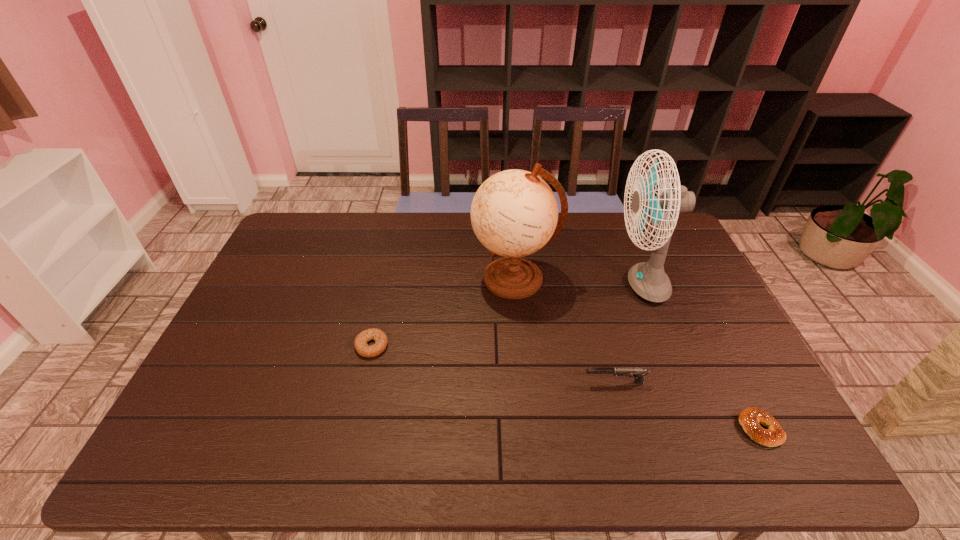
Find the location of a particular element. This screenshot has width=960, height=540. vacant space situated on the front-facing side of the fan is located at coordinates (489, 285).

Locate an element on the screen. The image size is (960, 540). vacant area located on the surface of the globe is located at coordinates (407, 279).

Find the location of a particular element. free space located on the surface of the globe is located at coordinates (456, 279).

This screenshot has height=540, width=960. I want to click on free space located on the surface of the globe, so click(417, 279).

At what (x,y) coordinates should I click in order to perform the action: click on vacant space located at the muzzle end of the gun. Please return your answer as a coordinate pair (x, y). The image size is (960, 540). Looking at the image, I should click on (476, 383).

Find the location of a particular element. This screenshot has height=540, width=960. free space located at the muzzle end of the gun is located at coordinates (541, 383).

At what (x,y) coordinates should I click in order to perform the action: click on vacant space located at the muzzle end of the gun. Please return your answer as a coordinate pair (x, y). This screenshot has width=960, height=540. Looking at the image, I should click on (515, 383).

This screenshot has width=960, height=540. What are the coordinates of `vacant space located on the front of the left bagel` in the screenshot? It's located at (358, 405).

Find the location of a particular element. The image size is (960, 540). vacant point located 0.140m on the left of the nearest object is located at coordinates (682, 429).

I want to click on object at the near edge, so click(749, 418).